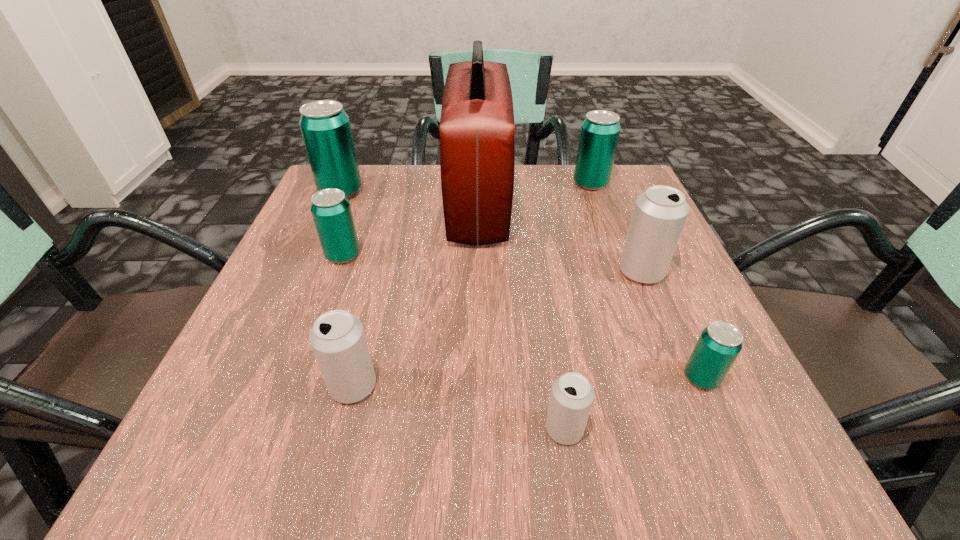
Where is `free spot between the second nearest teal beer can and the farthest white beer can`? The height and width of the screenshot is (540, 960). free spot between the second nearest teal beer can and the farthest white beer can is located at coordinates (492, 264).

At what (x,y) coordinates should I click in order to perform the action: click on empty space between the first aid kit and the second white beer can from left to right. Please return your answer as a coordinate pair (x, y). Image resolution: width=960 pixels, height=540 pixels. Looking at the image, I should click on (521, 316).

At what (x,y) coordinates should I click in order to perform the action: click on free space between the fourth object from left to right and the second smallest teal beer can. Please return your answer as a coordinate pair (x, y). This screenshot has width=960, height=540. Looking at the image, I should click on (411, 229).

Locate an element on the screen. This screenshot has width=960, height=540. free area in between the third smallest teal beer can and the red first aid kit is located at coordinates (535, 193).

Locate an element on the screen. The width and height of the screenshot is (960, 540). vacant area that lies between the leftmost white beer can and the nearest teal beer can is located at coordinates (527, 382).

Image resolution: width=960 pixels, height=540 pixels. In order to click on vacant space in between the first aid kit and the third object from left to right in this screenshot , I will do `click(416, 294)`.

I want to click on free space between the seventh shortest object and the fifth object from right to left, so [x=409, y=197].

This screenshot has height=540, width=960. I want to click on vacant area between the fourth object from left to right and the tallest beer can, so click(x=409, y=197).

Locate which object ranks fourth in proximity to the third smallest teal beer can. Please provide its 2D coordinates. Your answer should be formatted as a tuple, i.e. [(x, y)], where the tuple contains the x and y coordinates of a point satisfying the conditions above.

[(331, 211)]

Choose which object is the third nearest neighbor to the second white beer can from left to right. Please provide its 2D coordinates. Your answer should be formatted as a tuple, i.e. [(x, y)], where the tuple contains the x and y coordinates of a point satisfying the conditions above.

[(659, 215)]